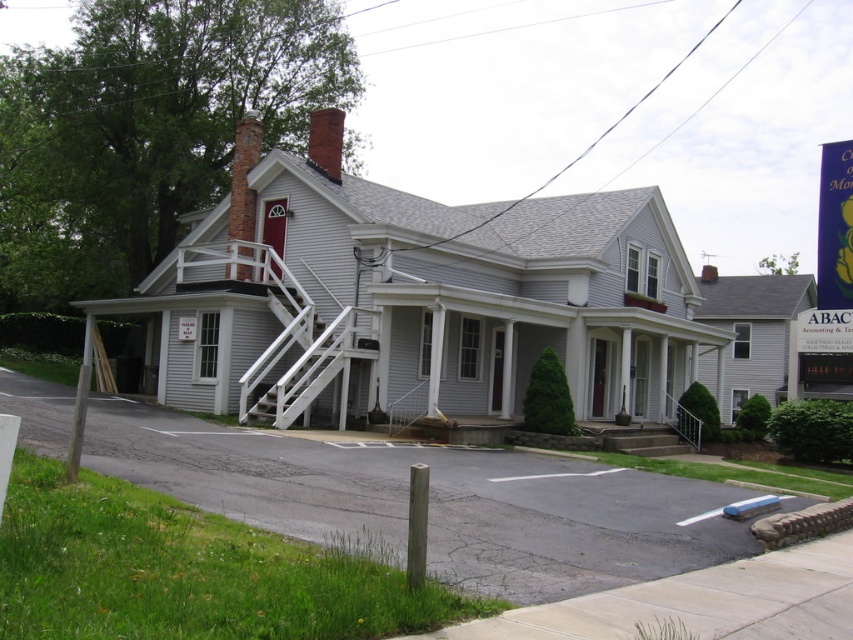
Question: Which object is closer to the camera taking this photo?

Choices:
 (A) brick chimney at upper left
 (B) white painted wood porch at center
 (C) white wooden staircase at center
 (D) brown wooden post at lower center

Answer: (D)

Question: Which of these objects is positioned closest to the white painted wood porch at center?

Choices:
 (A) white wooden staircase at center
 (B) brick chimney at upper left

Answer: (A)

Question: In this image, where is white painted wood porch at center located relative to white wooden staircase at center?

Choices:
 (A) right
 (B) left

Answer: (A)

Question: Which of these objects is positioned closest to the white wooden staircase at center?

Choices:
 (A) brick chimney at upper left
 (B) white painted wood porch at center

Answer: (B)

Question: Is white painted wood porch at center wider than brown wooden post at lower center?

Choices:
 (A) no
 (B) yes

Answer: (B)

Question: Can you confirm if white wooden staircase at center is thinner than brick chimney at upper left?

Choices:
 (A) yes
 (B) no

Answer: (B)